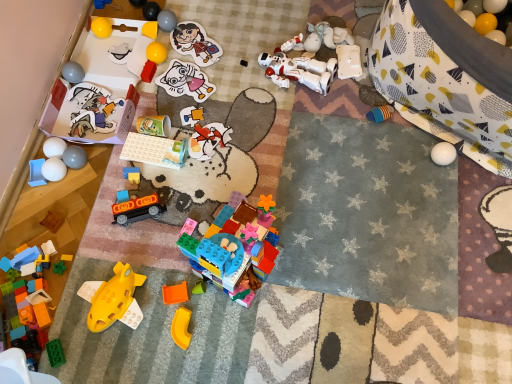
The width and height of the screenshot is (512, 384). I want to click on vacant space in front of white matte robot at upper center, positioned as the 23th toy in left-to-right order, so click(x=298, y=124).